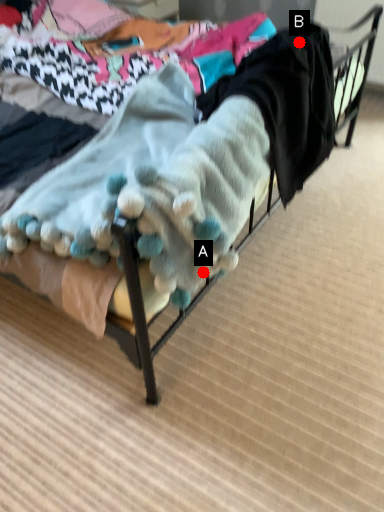
Question: Two points are circled on the image, labeled by A and B beside each circle. Which of the following is the farthest from the observer?

Choices:
 (A) A is further
 (B) B is further

Answer: (B)